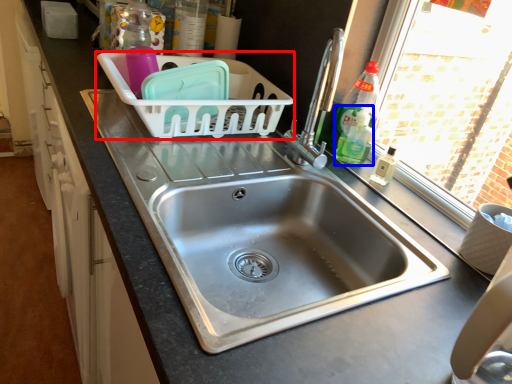
Question: Which object appears farthest to the camera in this image, basket (highlighted by a red box) or bottle (highlighted by a blue box)?

Choices:
 (A) basket
 (B) bottle

Answer: (B)